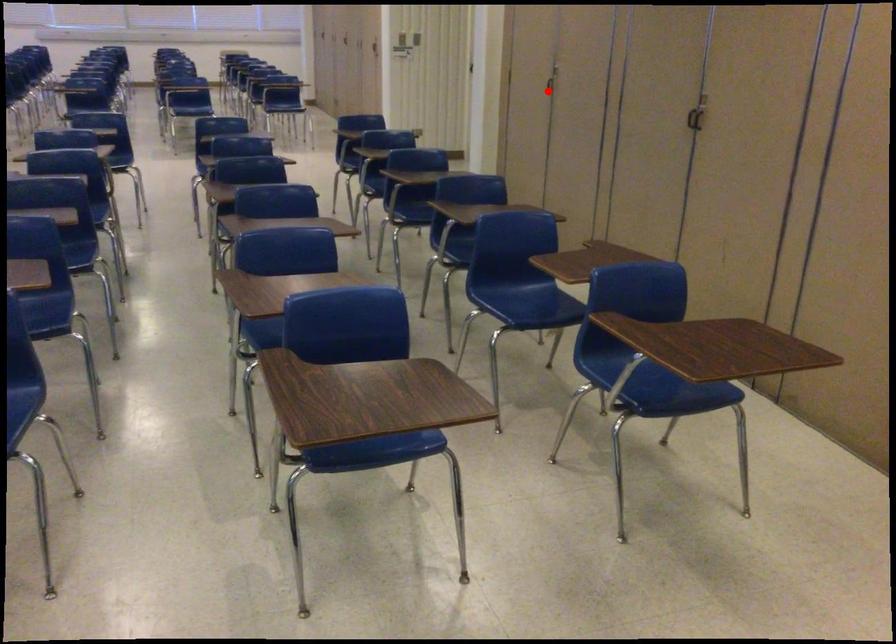
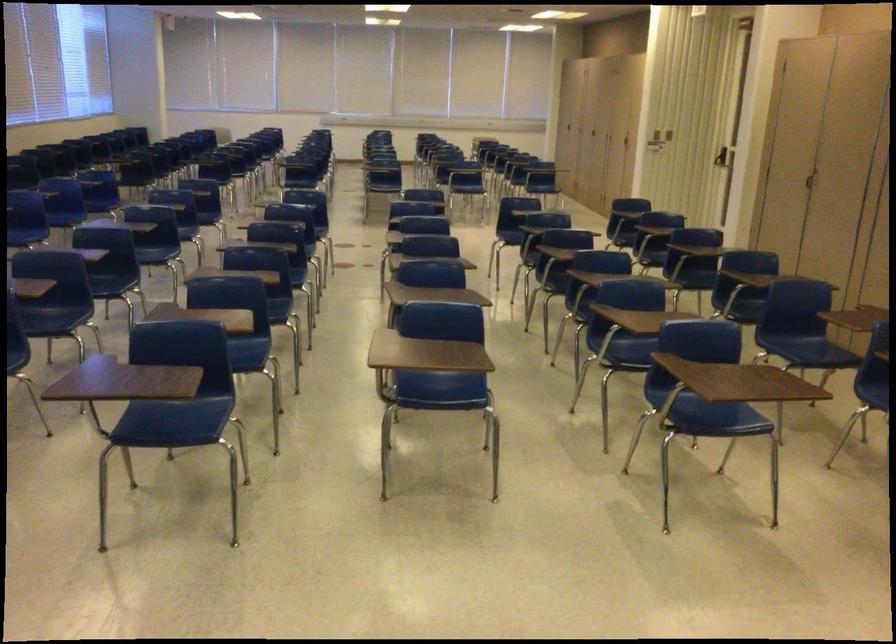
Question: I am providing you with two images of the same scene from different viewpoints. Image1 has a red point marked. In image2, the corresponding 3D location appears at what relative position? Reply with the corresponding letter.

Choices:
 (A) Closer
 (B) Farther

Answer: (B)